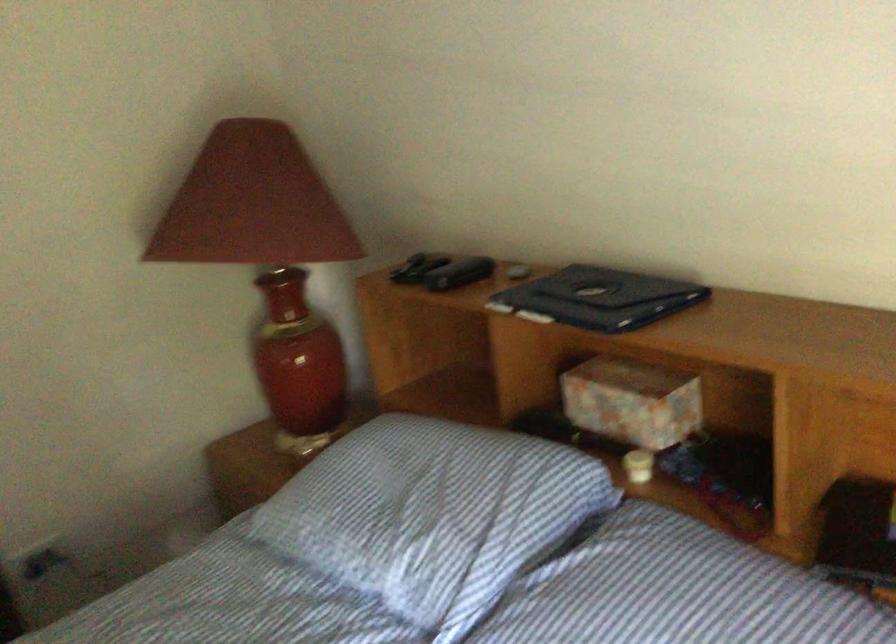
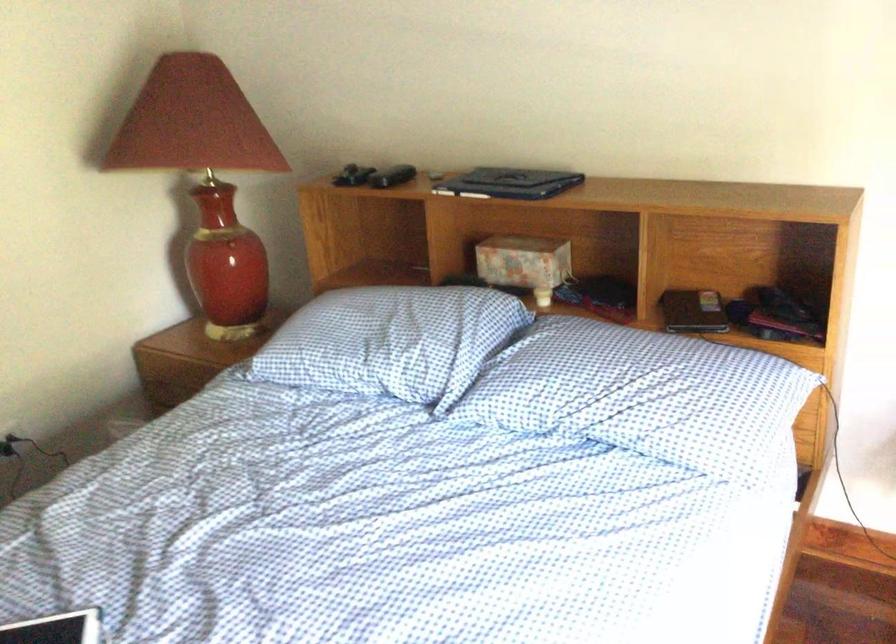
The point at (625, 410) is marked in the first image. Where is the corresponding point in the second image?

(524, 263)